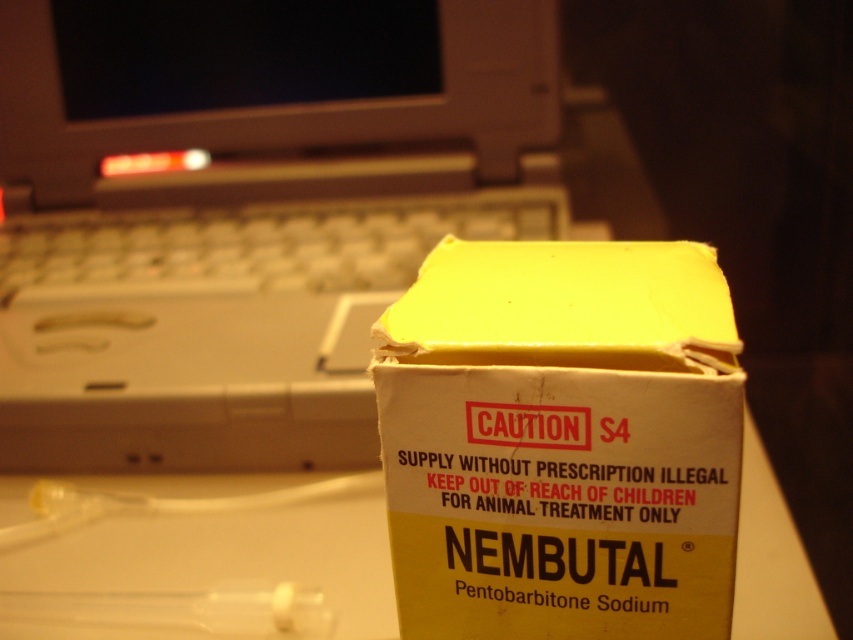
Question: Which of the following is the farthest from the observer?

Choices:
 (A) (227, 257)
 (B) (248, 416)
 (C) (397, 513)

Answer: (A)

Question: In this image, where is white plastic laptop at center located relative to white plastic keyboard at upper left?

Choices:
 (A) left
 (B) right

Answer: (A)

Question: Which point is farther to the camera?

Choices:
 (A) (416, 170)
 (B) (622, 419)

Answer: (A)

Question: Where is white plastic laptop at center located in relation to yellow cardboard box at center in the image?

Choices:
 (A) above
 (B) below

Answer: (A)

Question: Is white plastic laptop at center positioned at the back of white plastic keyboard at upper left?

Choices:
 (A) no
 (B) yes

Answer: (A)

Question: Which object is farther from the camera taking this photo?

Choices:
 (A) white plastic keyboard at upper left
 (B) yellow cardboard box at center

Answer: (A)